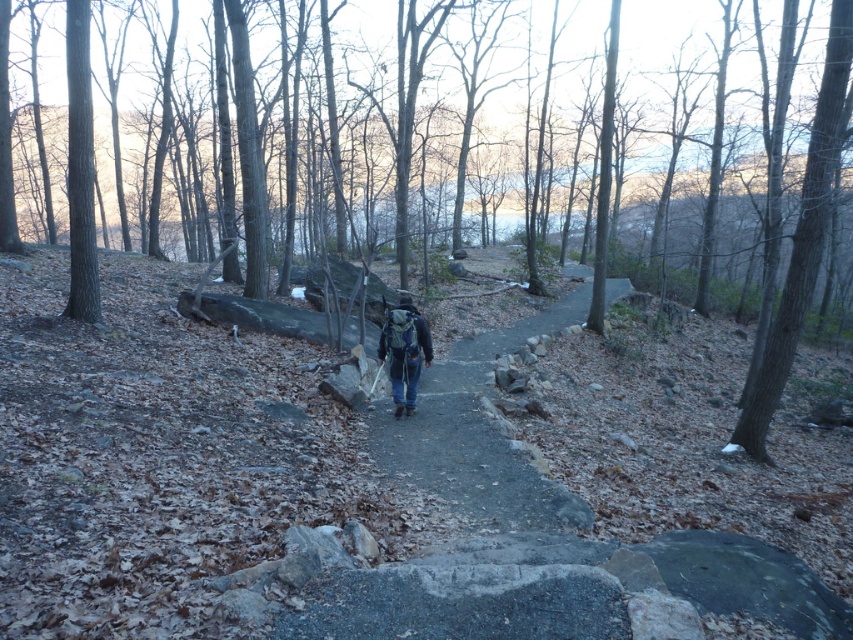
You are a hiker standing on the smooth gray stone path at center. You notice dark blue jeans at center nearby. Which object is higher in elevation?

The smooth gray stone path at center is taller than dark blue jeans at center, so the smooth gray stone path at center is higher in elevation.

You are standing at the entrance of the forest and see the smooth gray stone path at center. If you want to reach the path as quickly as possible, in which direction should you walk? Please answer with either north, south, east, or west.

The smooth gray stone path at center is located at coordinates (477, 435). Since the path is at the center of the image, you should walk directly towards it, which would be the direction indicated by the path coordinates. However, without additional directional context, the most straightforward answer is to walk towards the center of the scene where the path is located.